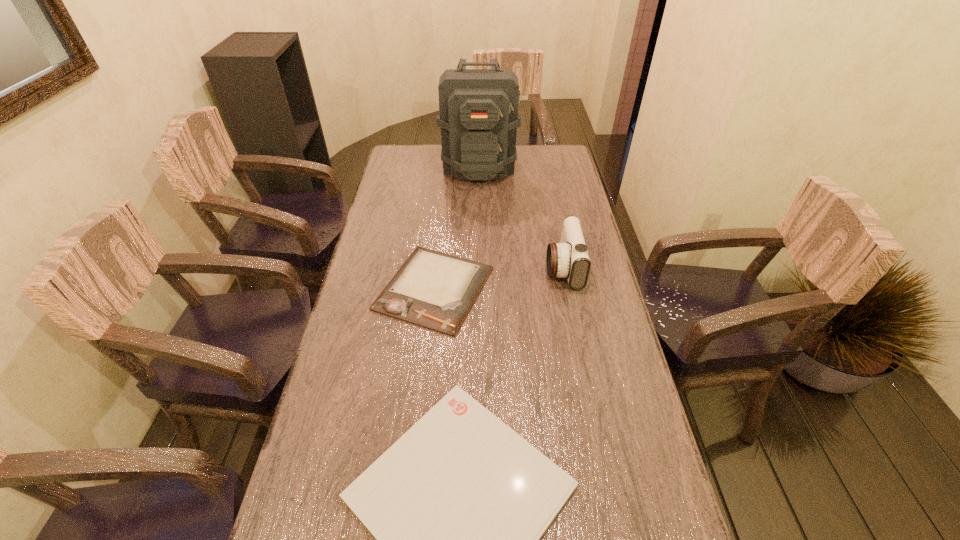
Find the location of a particular element. The width and height of the screenshot is (960, 540). empty location between the rightmost object and the tallest object is located at coordinates (521, 217).

Locate an element on the screen. This screenshot has height=540, width=960. object that is the third closest to the camcorder is located at coordinates (478, 116).

Identify the location of object identified as the third closest to the farthest object. (457, 505).

Locate an element on the screen. Image resolution: width=960 pixels, height=540 pixels. vacant area in the image that satisfies the following two spatial constraints: 1. on the surface of the rightmost object; 2. on the front side of the farther clipboard is located at coordinates (566, 288).